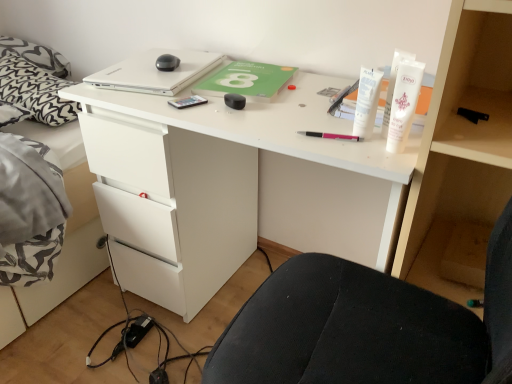
You are a GUI agent. You are given a task and a screenshot of the screen. Output one action in this format:
    pyautogui.click(x=<x>, y=<y>)
    Task: Click on the free space to the back side of white matte tube at upper right, the second toiletry viewed from the right
    This screenshot has width=512, height=384.
    Given the screenshot: What is the action you would take?
    pyautogui.click(x=319, y=109)